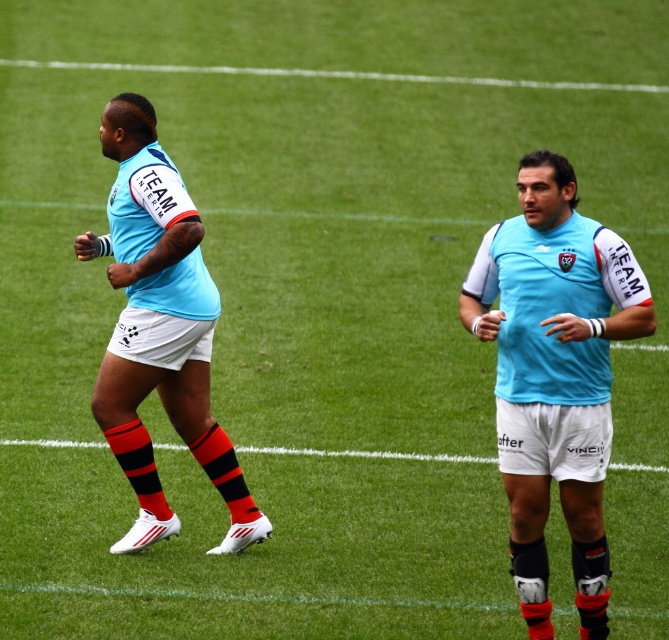
You are a photographer positioned at the center of the rugby field. You want to take a photo of the light blue jersey at center. Based on its position, which direction should you aim your camera to capture it?

The light blue jersey at center is located at point coordinates 0.586 on the x and 0.830 on the y axis. Since the photographer is at the center, they should aim their camera slightly to the right and upwards to capture the light blue jersey at center.

You are a photographer standing on the rugby field and want to take a photo of both the light blue jersey at center and the light blue jersey at left. Which jersey should you focus on first to ensure it appears larger in the photo?

You should focus on the light blue jersey at center first because it is closer to the viewer and will appear larger in the photo compared to the light blue jersey at left, which is farther away.